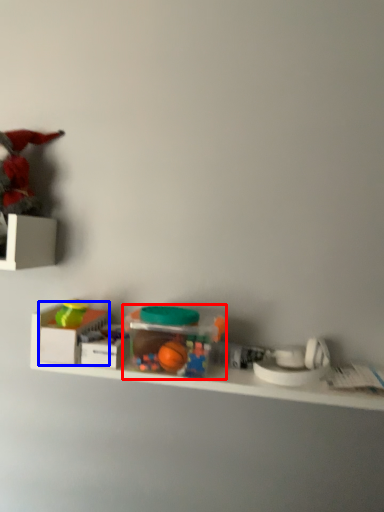
Question: Which object is closer to the camera taking this photo, toy (highlighted by a red box) or storage box (highlighted by a blue box)?

Choices:
 (A) toy
 (B) storage box

Answer: (A)